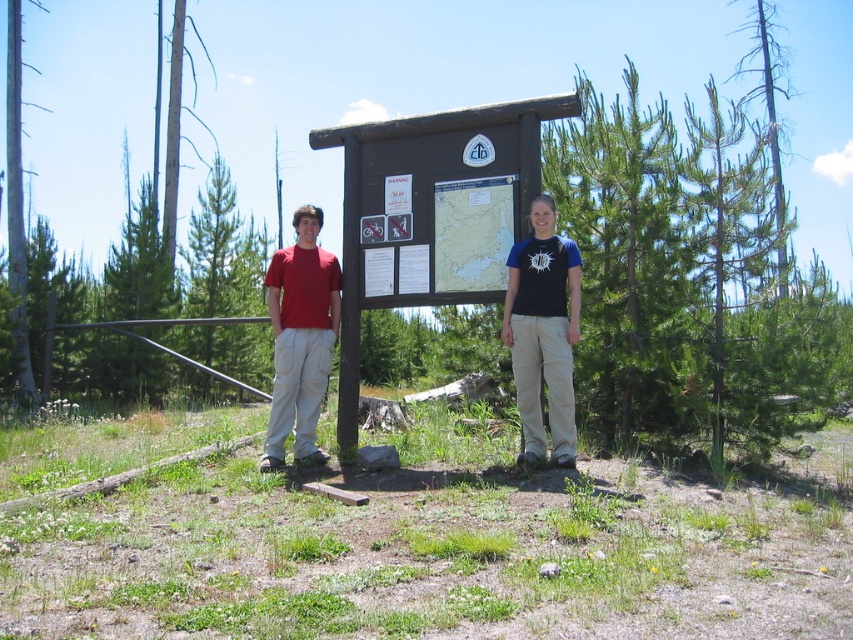
Question: Among these points, which one is nearest to the camera?

Choices:
 (A) [537, 397]
 (B) [9, 186]
 (C) [566, 433]
 (D) [393, 147]

Answer: (C)

Question: Considering the real-world distances, which object is farthest from the smooth bark tree at left?

Choices:
 (A) blue cotton shirt at center
 (B) wooden sign at center
 (C) matte red t-shirt at left
 (D) matte red shirt at center

Answer: (D)

Question: Does matte red shirt at center have a lesser width compared to smooth bark tree at left?

Choices:
 (A) yes
 (B) no

Answer: (B)

Question: Can you confirm if wooden sign at center is thinner than blue cotton shirt at center?

Choices:
 (A) yes
 (B) no

Answer: (B)

Question: Based on their relative distances, which object is nearer to the wooden sign at center?

Choices:
 (A) blue cotton shirt at center
 (B) matte red shirt at center
 (C) matte red t-shirt at left
 (D) smooth bark tree at left

Answer: (A)

Question: Does wooden sign at center appear on the right side of matte red t-shirt at left?

Choices:
 (A) yes
 (B) no

Answer: (A)